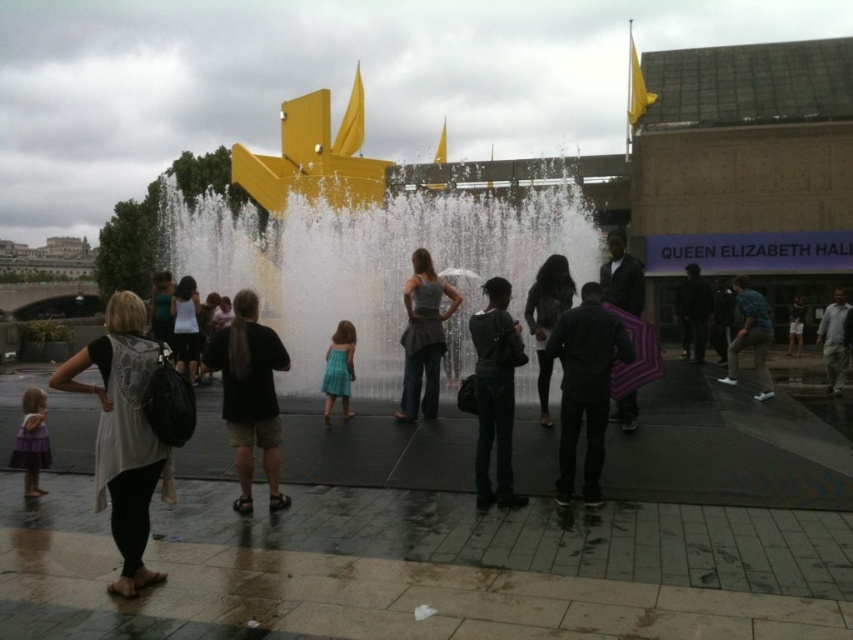
Question: Which point is farther to the camera?

Choices:
 (A) dark gray fabric jacket at center
 (B) dark brown fur coat at center
 (C) matte black backpack at left

Answer: (B)

Question: Is black matte jacket at center smaller than dark gray fabric jacket at center?

Choices:
 (A) yes
 (B) no

Answer: (A)

Question: Can you confirm if white frothy water at center is positioned to the left of dark gray fabric jacket at center?

Choices:
 (A) no
 (B) yes

Answer: (B)

Question: In this image, where is gray fabric dress at center located relative to gray cotton shirt at center?

Choices:
 (A) below
 (B) above

Answer: (B)

Question: Estimate the real-world distances between objects in this image. Which object is farther from the black leather jacket at center?

Choices:
 (A) black matte jacket at center
 (B) black cotton shirt at center
 (C) gray cotton shirt at center

Answer: (B)

Question: Which object is farther from the camera taking this photo?

Choices:
 (A) dark brown fur coat at center
 (B) dark gray fabric jacket at center
 (C) white matte tank top at center
 (D) black leather jacket at center

Answer: (D)